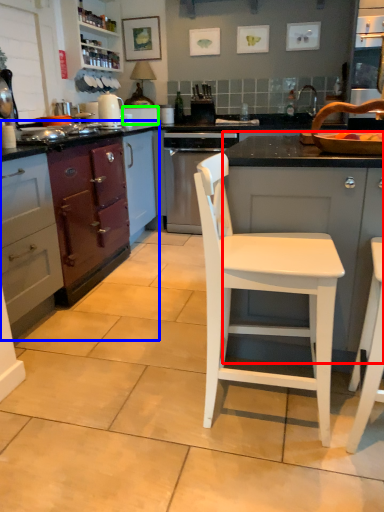
Question: Which object is positioned farthest from cabinetry (highlighted by a red box)? Select from cabinetry (highlighted by a blue box) and appliance (highlighted by a green box).

Choices:
 (A) cabinetry
 (B) appliance

Answer: (B)